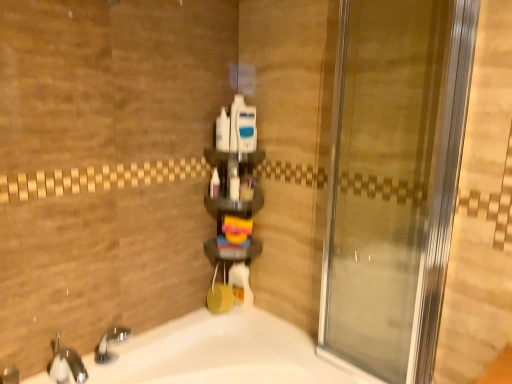
Question: Is white plastic bottles at center, placed as the 2th toiletry when sorted from left to right, surrounding blue plastic razor at center, the fifth toiletry from the left?

Choices:
 (A) no
 (B) yes

Answer: (A)

Question: Can we say white plastic bottles at center, placed as the 2th toiletry when sorted from left to right, lies outside blue plastic razor at center, the fifth toiletry from the left?

Choices:
 (A) yes
 (B) no

Answer: (A)

Question: Does white plastic bottles at center, placed as the 4th toiletry when sorted from right to left, appear on the right side of blue plastic razor at center, which is the first toiletry from right to left?

Choices:
 (A) yes
 (B) no

Answer: (B)

Question: From the image's perspective, does white plastic bottles at center, placed as the 4th toiletry when sorted from right to left, appear higher than blue plastic razor at center, which is the first toiletry from right to left?

Choices:
 (A) no
 (B) yes

Answer: (B)

Question: Are white plastic bottles at center, placed as the 4th toiletry when sorted from right to left, and blue plastic razor at center, the fifth toiletry from the left, located far from each other?

Choices:
 (A) yes
 (B) no

Answer: (B)

Question: Could you tell me if white plastic bottles at center, placed as the 4th toiletry when sorted from right to left, is turned towards blue plastic razor at center, the fifth toiletry from the left?

Choices:
 (A) yes
 (B) no

Answer: (B)

Question: Is white plastic container at center, the 4th toiletry when ordered from left to right, positioned behind white plastic bottles at center, placed as the 2th toiletry when sorted from left to right?

Choices:
 (A) yes
 (B) no

Answer: (A)

Question: Can you confirm if white plastic container at center, the 2th toiletry positioned from the right, is positioned to the right of white plastic bottles at center, placed as the 2th toiletry when sorted from left to right?

Choices:
 (A) yes
 (B) no

Answer: (A)

Question: Is white plastic container at center, the 4th toiletry when ordered from left to right, not within white plastic bottles at center, placed as the 4th toiletry when sorted from right to left?

Choices:
 (A) yes
 (B) no

Answer: (A)

Question: Can you confirm if white plastic container at center, the 4th toiletry when ordered from left to right, is taller than white plastic bottles at center, placed as the 4th toiletry when sorted from right to left?

Choices:
 (A) yes
 (B) no

Answer: (A)

Question: Is white plastic container at center, the 2th toiletry positioned from the right, with white plastic bottles at center, placed as the 2th toiletry when sorted from left to right?

Choices:
 (A) yes
 (B) no

Answer: (A)

Question: Can you confirm if white plastic container at center, the 4th toiletry when ordered from left to right, is shorter than white plastic bottles at center, placed as the 2th toiletry when sorted from left to right?

Choices:
 (A) yes
 (B) no

Answer: (B)

Question: From a real-world perspective, is white glossy bottle at center, positioned as the third toiletry in left-to-right order, positioned under white plastic container at center, the 2th toiletry positioned from the right, based on gravity?

Choices:
 (A) no
 (B) yes

Answer: (B)